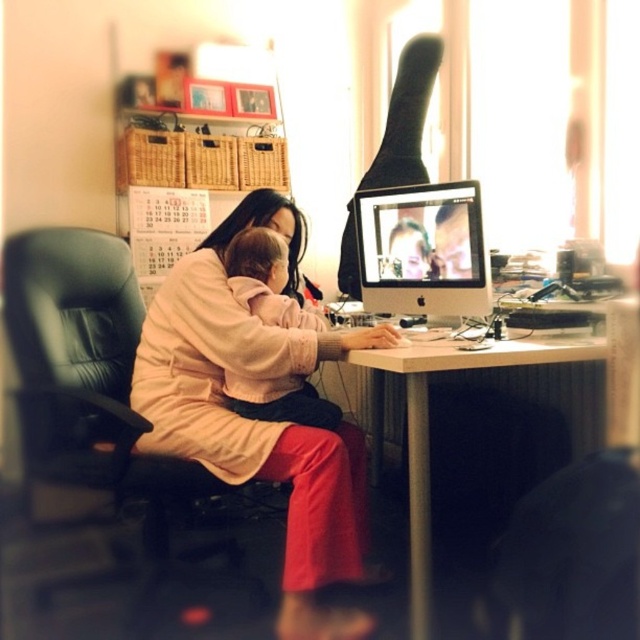
Is white glossy table at center taller than soft pink fabric baby at center?

Correct, white glossy table at center is much taller as soft pink fabric baby at center.

Describe the element at coordinates (428, 426) in the screenshot. I see `white glossy table at center` at that location.

The width and height of the screenshot is (640, 640). Find the location of `white glossy table at center`. white glossy table at center is located at coordinates (428, 426).

Does point (136, 476) come in front of point (413, 596)?

No, it is not.

Does black leather chair at left appear on the right side of white glossy table at center?

Incorrect, black leather chair at left is not on the right side of white glossy table at center.

Does point (184, 481) lie behind point (435, 349)?

Yes, point (184, 481) is farther from viewer.

I want to click on black leather chair at left, so click(99, 396).

Is black leather chair at left bigger than soft pink fabric baby at center?

Yes.

You are a GUI agent. You are given a task and a screenshot of the screen. Output one action in this format:
    pyautogui.click(x=<x>, y=<y>)
    Task: Click on the black leather chair at left
    
    Given the screenshot: What is the action you would take?
    pyautogui.click(x=99, y=396)

You are a GUI agent. You are given a task and a screenshot of the screen. Output one action in this format:
    pyautogui.click(x=<x>, y=<y>)
    Task: Click on the black leather chair at left
    This screenshot has width=640, height=640.
    Given the screenshot: What is the action you would take?
    pyautogui.click(x=99, y=396)